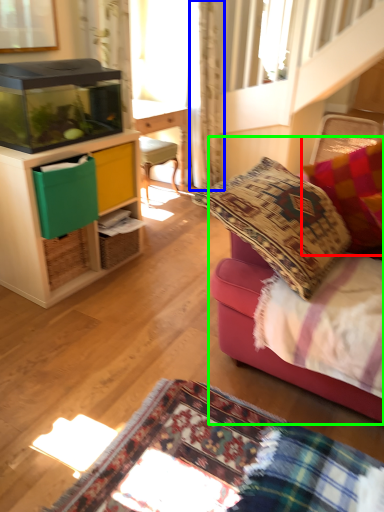
Question: Which is farther away from pillow (highlighted by a red box)? curtain (highlighted by a blue box) or studio couch (highlighted by a green box)?

Choices:
 (A) curtain
 (B) studio couch

Answer: (A)